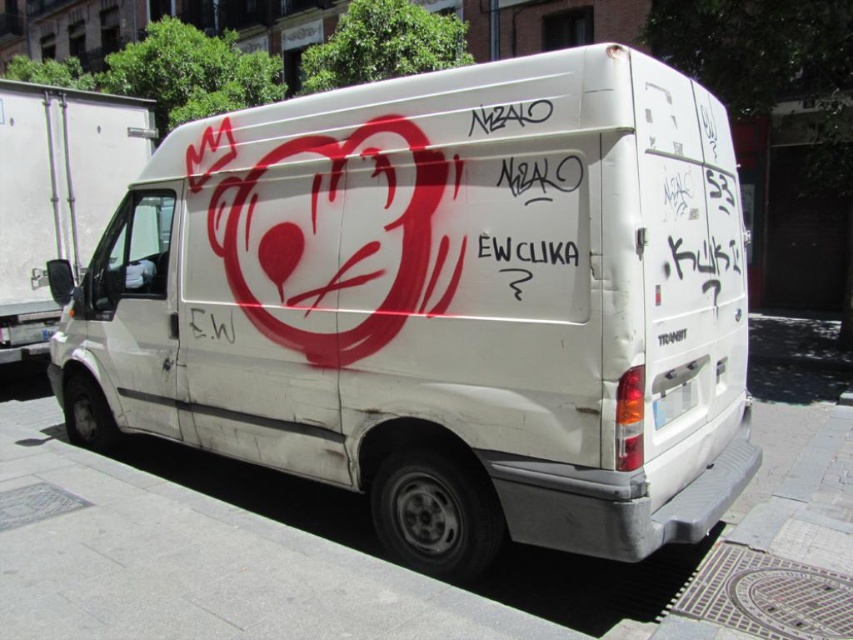
Question: Can you confirm if white matte van at center is positioned below white matte van at left?

Choices:
 (A) yes
 (B) no

Answer: (A)

Question: Does white matte van at center have a greater width compared to white matte van at left?

Choices:
 (A) no
 (B) yes

Answer: (B)

Question: Which point appears farthest from the camera in this image?

Choices:
 (A) (13, 358)
 (B) (692, 467)

Answer: (A)

Question: Which object is closer to the camera taking this photo?

Choices:
 (A) white matte van at left
 (B) white matte van at center

Answer: (B)

Question: Which point is closer to the camera?

Choices:
 (A) (410, 150)
 (B) (3, 278)

Answer: (A)

Question: Is white matte van at center bigger than white matte van at left?

Choices:
 (A) no
 (B) yes

Answer: (B)